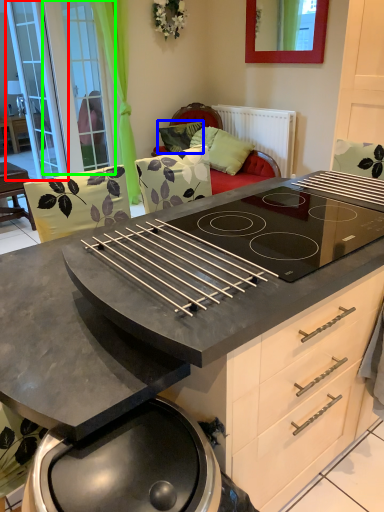
Question: Estimate the real-world distances between objects in this image. Which object is closer to screen door (highlighted by a red box), pillow (highlighted by a blue box) or screen door (highlighted by a green box)?

Choices:
 (A) pillow
 (B) screen door

Answer: (B)